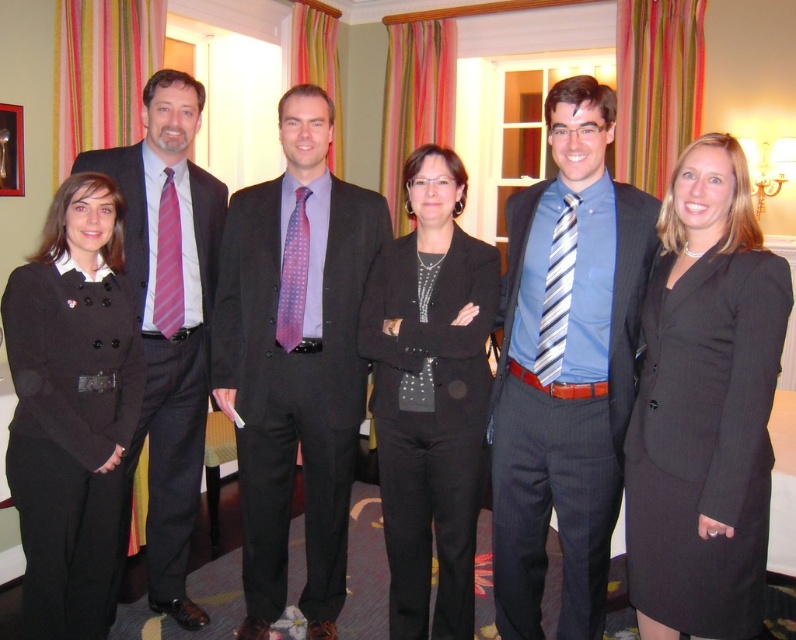
Question: Estimate the real-world distances between objects in this image. Which object is closer to the matte black suit at left?

Choices:
 (A) black matte blazer at center
 (B) matte purple tie at center
 (C) blue striped tie at center
 (D) matte black blazer at left

Answer: (D)

Question: Is the position of dark gray pinstripe suit at right more distant than that of matte black blazer at left?

Choices:
 (A) no
 (B) yes

Answer: (A)

Question: Does matte black blazer at left have a smaller size compared to pink dotted tie at center?

Choices:
 (A) no
 (B) yes

Answer: (A)

Question: Which point is closer to the camera?

Choices:
 (A) (174, 243)
 (B) (283, 276)
 (C) (574, 189)
 (D) (274, 289)

Answer: (C)

Question: Is black matte blazer at center closer to the viewer compared to pink dotted tie at center?

Choices:
 (A) no
 (B) yes

Answer: (B)

Question: Which object is the closest to the striped fabric tie at center?

Choices:
 (A) pink dotted tie at center
 (B) black matte blazer at center

Answer: (B)